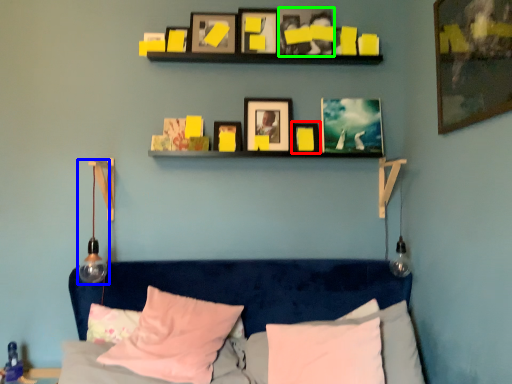
Question: Which object is positioned farthest from picture frame (highlighted by a red box)? Select from lamp (highlighted by a blue box) and picture frame (highlighted by a green box).

Choices:
 (A) lamp
 (B) picture frame

Answer: (A)